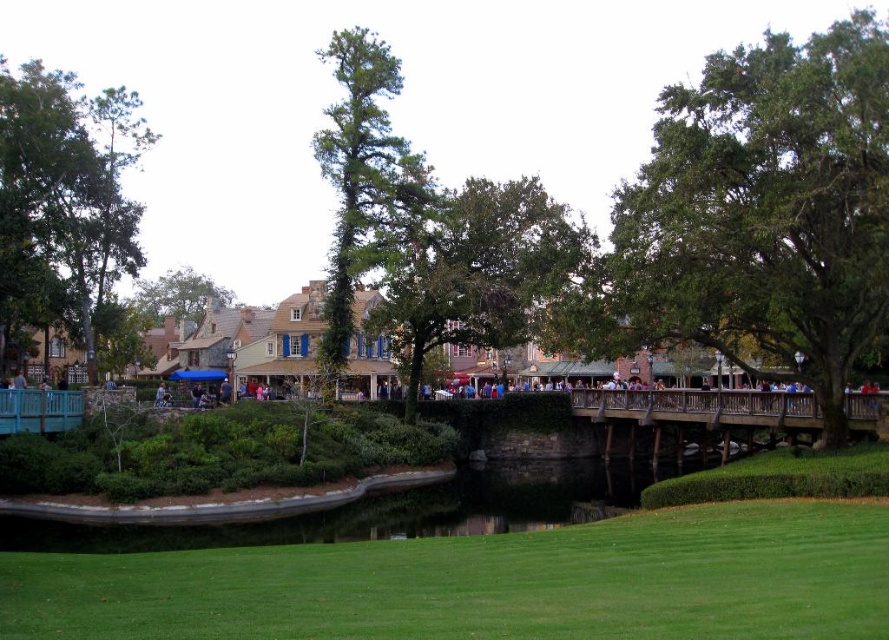
Question: Does green grass at lower center appear over wooden bridge at center?

Choices:
 (A) no
 (B) yes

Answer: (A)

Question: Which point appears closest to the camera in this image?

Choices:
 (A) (847, 410)
 (B) (599, 598)

Answer: (B)

Question: Which of the following is the closest to the observer?

Choices:
 (A) (686, 394)
 (B) (273, 636)

Answer: (B)

Question: Which object appears closest to the camera in this image?

Choices:
 (A) wooden bridge at center
 (B) green grass at lower center

Answer: (B)

Question: Can you confirm if green grass at lower center is positioned below wooden bridge at center?

Choices:
 (A) yes
 (B) no

Answer: (A)

Question: In this image, where is green grass at lower center located relative to wooden bridge at center?

Choices:
 (A) right
 (B) left

Answer: (B)